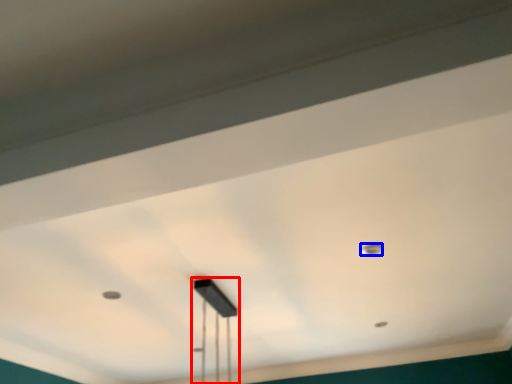
Question: Among these objects, which one is nearest to the camera, lamp (highlighted by a red box) or dot (highlighted by a blue box)?

Choices:
 (A) lamp
 (B) dot

Answer: (A)